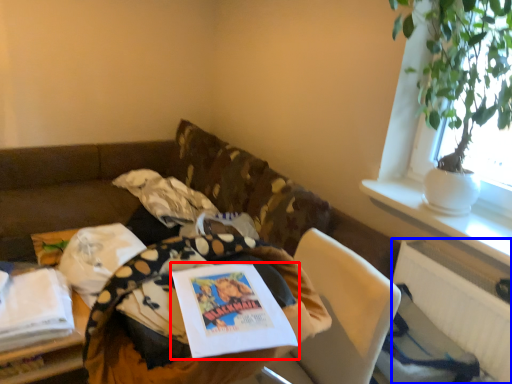
Question: Among these objects, which one is farthest to the camera, book (highlighted by a red box) or radiator (highlighted by a blue box)?

Choices:
 (A) book
 (B) radiator

Answer: (B)